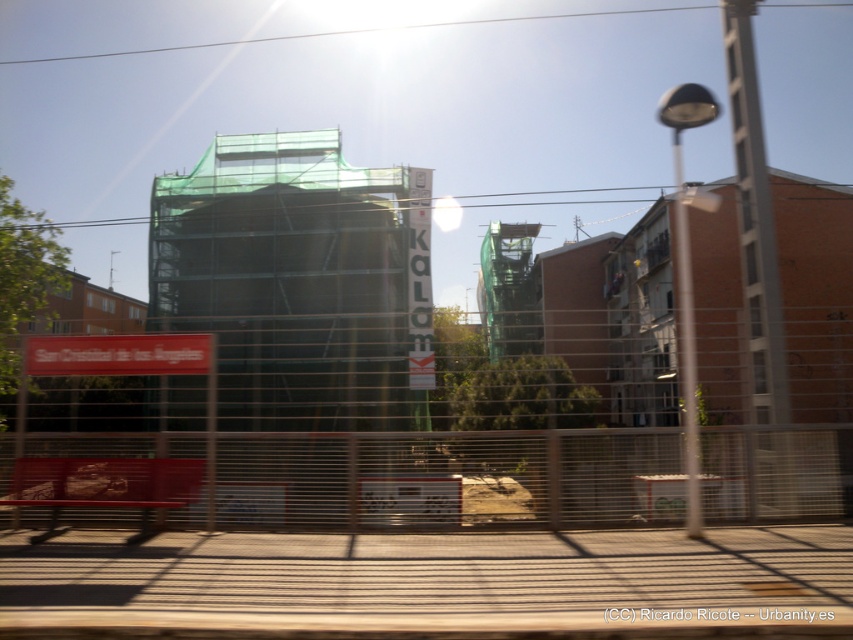
You are a delivery drone flying over an urban area. You need to navigate between two points marked as point (554, 634) and point (773, 484). Based on the scene, which point is closer to the metal fence in the foreground?

Point (554, 634) is in front of point (773, 484), so it is closer to the metal fence in the foreground.

You are a passenger on a train and notice the brown wooden train track at lower center and the metallic wire mesh at lower center. Which object is closer to the front of the train?

The brown wooden train track at lower center is closer to the front of the train because it is located below the metallic wire mesh at lower center, indicating it is in a lower position relative to the observer.

You are a delivery person trying to navigate through the scene. You need to pass between the metallic wire mesh at center and the brown wooden train track at lower center. Can you estimate if there is enough space for a standard delivery cart that is 1 meter wide?

The metallic wire mesh at center might be wider than brown wooden train track at lower center, so there might be sufficient space for the delivery cart to pass through. However, since the exact width isn not specified, it is recommended to check the actual distance before proceeding.